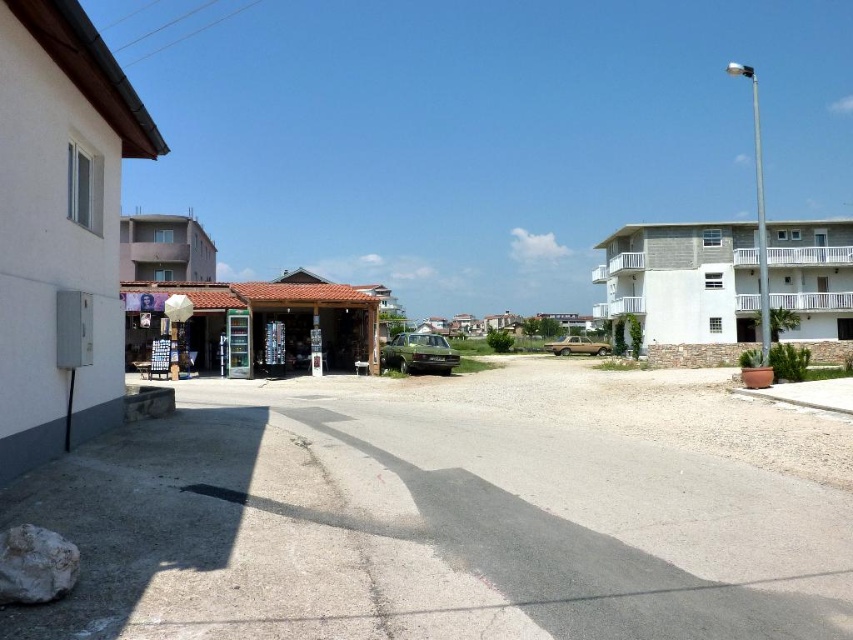
Can you confirm if matte brick shop at center is wider than gray concrete building at upper left?

No, matte brick shop at center is not wider than gray concrete building at upper left.

Is point (316, 292) positioned after point (137, 220)?

No, (316, 292) is in front of (137, 220).

Who is more distant from viewer, (296, 337) or (152, 272)?

Point (152, 272)

The width and height of the screenshot is (853, 640). I want to click on matte brick shop at center, so click(262, 323).

Does white matte building at left have a lesser height compared to white concrete building at center?

Indeed, white matte building at left has a lesser height compared to white concrete building at center.

This screenshot has height=640, width=853. What do you see at coordinates (61, 227) in the screenshot? I see `white matte building at left` at bounding box center [61, 227].

Is point (10, 291) positioned before point (498, 317)?

That is True.

At what (x,y) coordinates should I click in order to perform the action: click on white matte building at left. Please return your answer as a coordinate pair (x, y). This screenshot has width=853, height=640. Looking at the image, I should click on (61, 227).

Measure the distance between white concrete building at right and white concrete building at center.

white concrete building at right and white concrete building at center are 46.03 meters apart from each other.

Can you confirm if white concrete building at right is smaller than white concrete building at center?

Correct, white concrete building at right occupies less space than white concrete building at center.

Locate an element on the screen. white concrete building at right is located at coordinates (682, 280).